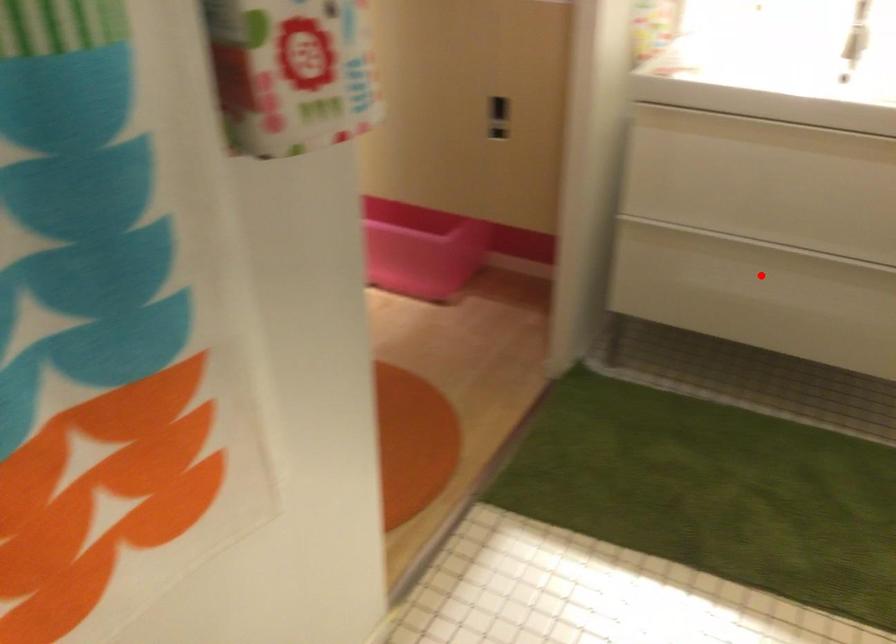
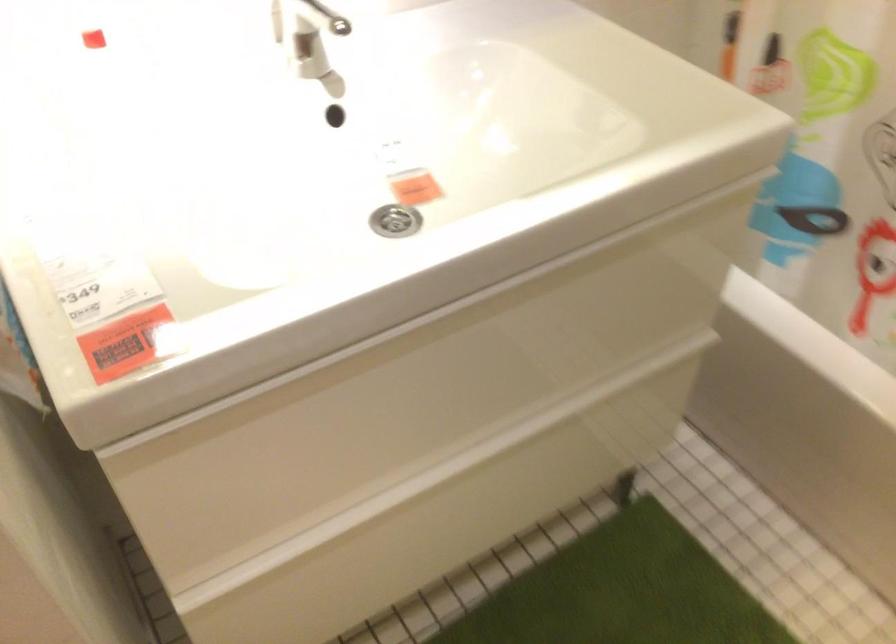
Locate, in the second image, the point that corresponds to the highlighted location in the first image.

(442, 514)